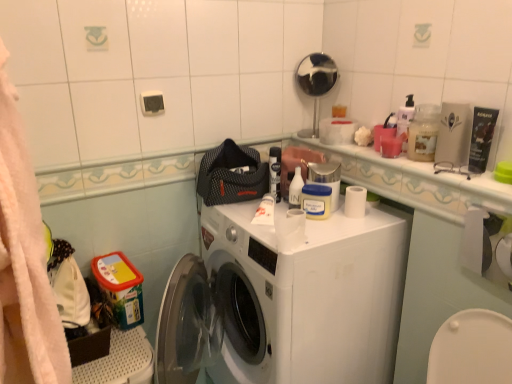
Question: Is matte black tube at upper right, placed as the fifth toiletry when sorted from left to right, to the right of white plastic bottle at upper center, arranged as the 5th toiletry when viewed from the right, from the viewer's perspective?

Choices:
 (A) yes
 (B) no

Answer: (A)

Question: Considering the relative sizes of matte black tube at upper right, marked as the first toiletry in a right-to-left arrangement, and white plastic bottle at upper center, which ranks as the first toiletry in left-to-right order, in the image provided, is matte black tube at upper right, marked as the first toiletry in a right-to-left arrangement, smaller than white plastic bottle at upper center, which ranks as the first toiletry in left-to-right order,?

Choices:
 (A) no
 (B) yes

Answer: (A)

Question: Is matte black tube at upper right, placed as the fifth toiletry when sorted from left to right, located outside white plastic bottle at upper center, which ranks as the first toiletry in left-to-right order?

Choices:
 (A) no
 (B) yes

Answer: (B)

Question: Does matte black tube at upper right, placed as the fifth toiletry when sorted from left to right, turn towards white plastic bottle at upper center, which ranks as the first toiletry in left-to-right order?

Choices:
 (A) no
 (B) yes

Answer: (A)

Question: From a real-world perspective, is matte black tube at upper right, placed as the fifth toiletry when sorted from left to right, physically above white plastic bottle at upper center, arranged as the 5th toiletry when viewed from the right?

Choices:
 (A) no
 (B) yes

Answer: (B)

Question: From the image's perspective, is white plastic washing machine at center located above or below white glossy counter top at upper right?

Choices:
 (A) above
 (B) below

Answer: (B)

Question: In terms of size, does white plastic washing machine at center appear bigger or smaller than white glossy counter top at upper right?

Choices:
 (A) small
 (B) big

Answer: (B)

Question: Considering their positions, is white plastic washing machine at center located in front of or behind white glossy counter top at upper right?

Choices:
 (A) front
 (B) behind

Answer: (A)

Question: Looking at their shapes, would you say white plastic washing machine at center is wider or thinner than white glossy counter top at upper right?

Choices:
 (A) thin
 (B) wide

Answer: (B)

Question: Would you say yellow matte jar at center, which is counted as the 4th toiletry, starting from the right, is inside or outside translucent plastic cup at upper right, marked as the 3th toiletry in a left-to-right arrangement?

Choices:
 (A) inside
 (B) outside

Answer: (B)

Question: Considering the relative positions of yellow matte jar at center, which is counted as the 4th toiletry, starting from the right, and translucent plastic cup at upper right, marked as the 3th toiletry in a left-to-right arrangement, in the image provided, is yellow matte jar at center, which is counted as the 4th toiletry, starting from the right, to the left or to the right of translucent plastic cup at upper right, marked as the 3th toiletry in a left-to-right arrangement,?

Choices:
 (A) right
 (B) left

Answer: (B)

Question: From the image's perspective, is yellow matte jar at center, which is counted as the 4th toiletry, starting from the right, located above or below translucent plastic cup at upper right, which is the third toiletry from right to left?

Choices:
 (A) above
 (B) below

Answer: (B)

Question: In terms of height, does yellow matte jar at center, which is counted as the 4th toiletry, starting from the right, look taller or shorter compared to translucent plastic cup at upper right, which is the third toiletry from right to left?

Choices:
 (A) short
 (B) tall

Answer: (A)

Question: Is yellow matte jar at center, the second toiletry viewed from the left, inside or outside of translucent plastic container at upper right?

Choices:
 (A) outside
 (B) inside

Answer: (A)

Question: Would you say yellow matte jar at center, which is counted as the 4th toiletry, starting from the right, is to the left or to the right of translucent plastic container at upper right in the picture?

Choices:
 (A) right
 (B) left

Answer: (B)